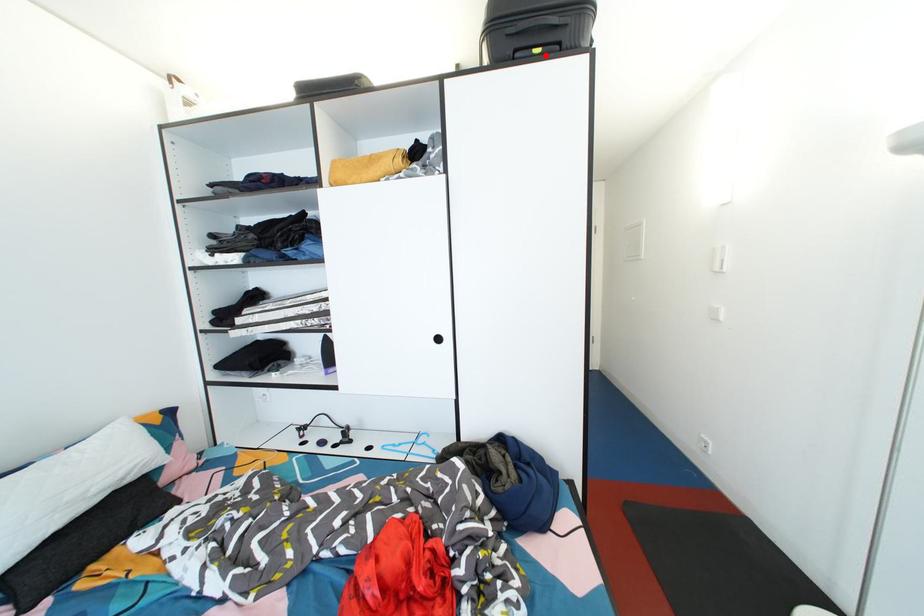
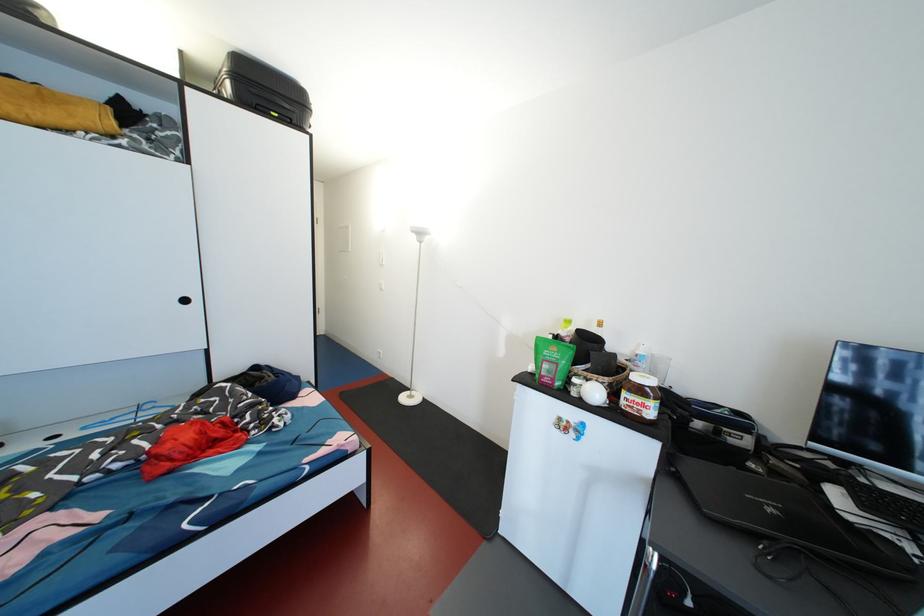
Locate, in the second image, the point that corresponds to the highlighted location in the first image.

(283, 120)